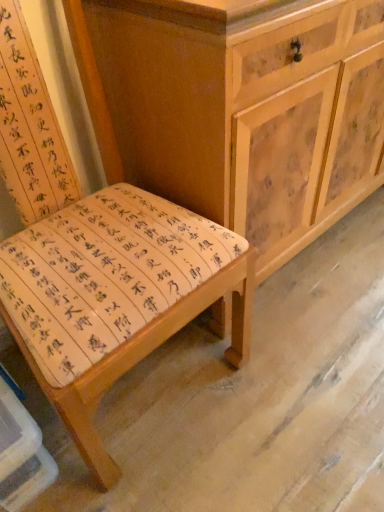
This screenshot has height=512, width=384. I want to click on free location to the right of wooden bench at center, so click(x=312, y=378).